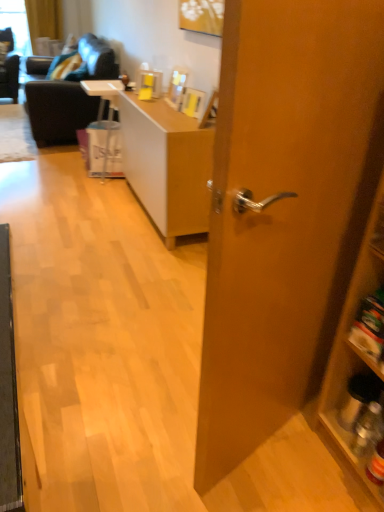
Question: Is light brown wood desk at center placed right next to white plastic bag at center?

Choices:
 (A) yes
 (B) no

Answer: (B)

Question: Is light brown wood desk at center outside white plastic bag at center?

Choices:
 (A) yes
 (B) no

Answer: (A)

Question: Does light brown wood desk at center have a lesser height compared to white plastic bag at center?

Choices:
 (A) yes
 (B) no

Answer: (B)

Question: From a real-world perspective, is light brown wood desk at center on white plastic bag at center?

Choices:
 (A) yes
 (B) no

Answer: (A)

Question: Would you say white plastic bag at center is part of light brown wood desk at center's contents?

Choices:
 (A) yes
 (B) no

Answer: (B)

Question: Considering the relative positions of light brown wood desk at center and white plastic bag at center in the image provided, is light brown wood desk at center to the right of white plastic bag at center from the viewer's perspective?

Choices:
 (A) yes
 (B) no

Answer: (A)

Question: Is light brown wood desk at center at the back of dark gray fabric couch at upper left?

Choices:
 (A) yes
 (B) no

Answer: (B)

Question: Can you confirm if dark gray fabric couch at upper left is smaller than light brown wood desk at center?

Choices:
 (A) no
 (B) yes

Answer: (A)

Question: From a real-world perspective, is dark gray fabric couch at upper left located beneath light brown wood desk at center?

Choices:
 (A) yes
 (B) no

Answer: (B)

Question: From a real-world perspective, is dark gray fabric couch at upper left over light brown wood desk at center?

Choices:
 (A) no
 (B) yes

Answer: (B)

Question: Is there a large distance between dark gray fabric couch at upper left and light brown wood desk at center?

Choices:
 (A) no
 (B) yes

Answer: (B)

Question: Can you confirm if dark gray fabric couch at upper left is shorter than light brown wood desk at center?

Choices:
 (A) yes
 (B) no

Answer: (B)

Question: Considering the relative sizes of white plastic bag at center and dark gray fabric couch at upper left in the image provided, is white plastic bag at center taller than dark gray fabric couch at upper left?

Choices:
 (A) no
 (B) yes

Answer: (A)